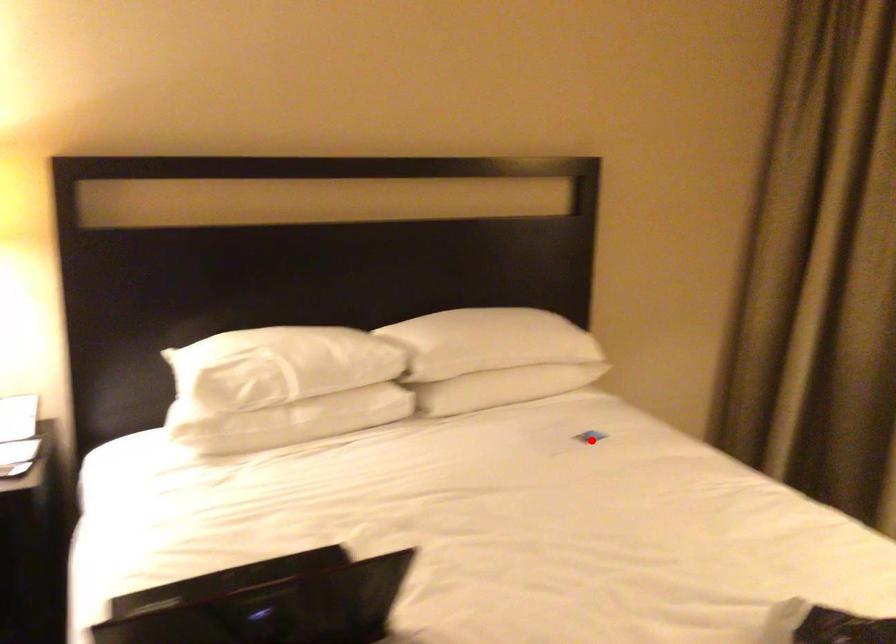
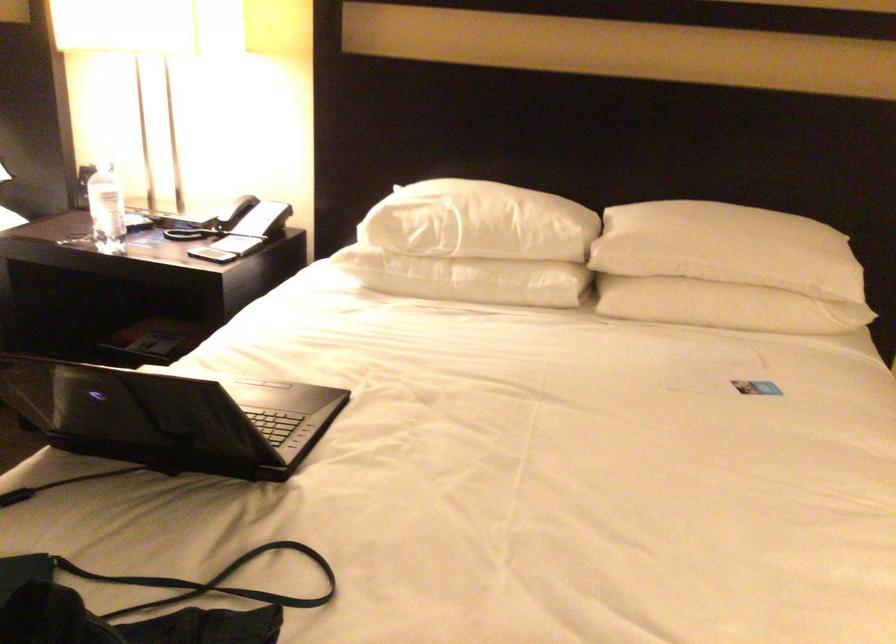
Question: I am providing you with two images of the same scene from different viewpoints. Given a red point in image1, look at the same physical point in image2. Is it:

Choices:
 (A) Closer to the viewpoint
 (B) Farther from the viewpoint

Answer: (A)